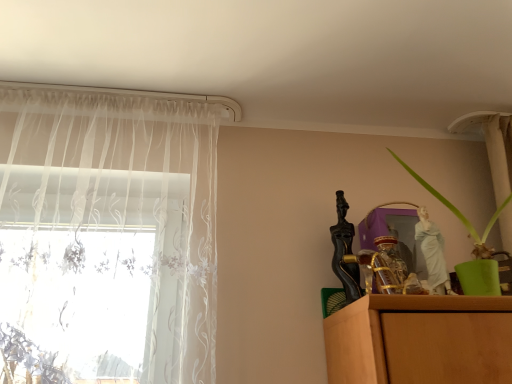
What do you see at coordinates (461, 214) in the screenshot? I see `green matte plant at right` at bounding box center [461, 214].

Where is `green matte plant at right`? green matte plant at right is located at coordinates (461, 214).

Where is `white sheer curtain at left`? The image size is (512, 384). white sheer curtain at left is located at coordinates (106, 239).

The image size is (512, 384). Describe the element at coordinates (106, 239) in the screenshot. I see `white sheer curtain at left` at that location.

Where is `green matte plant at right`? green matte plant at right is located at coordinates (461, 214).

Is green matte plant at right at the right side of white sheer curtain at left?

Correct, you'll find green matte plant at right to the right of white sheer curtain at left.

Which object is more forward, green matte plant at right or white sheer curtain at left?

green matte plant at right is more forward.

Considering the points (490, 250) and (56, 297), which point is behind, point (490, 250) or point (56, 297)?

The point (56, 297) is more distant.

From the image's perspective, between green matte plant at right and white sheer curtain at left, which one is located above?

green matte plant at right appears higher in the image.

From a real-world perspective, is green matte plant at right above or below white sheer curtain at left?

green matte plant at right is below white sheer curtain at left.

Can you confirm if green matte plant at right is thinner than white sheer curtain at left?

In fact, green matte plant at right might be wider than white sheer curtain at left.

Considering the relative sizes of green matte plant at right and white sheer curtain at left in the image provided, is green matte plant at right shorter than white sheer curtain at left?

Yes, green matte plant at right is shorter than white sheer curtain at left.

Is green matte plant at right smaller than white sheer curtain at left?

Yes.

Can white sheer curtain at left be found inside green matte plant at right?

No, white sheer curtain at left is not inside green matte plant at right.

Is there a large distance between green matte plant at right and white sheer curtain at left?

They are positioned close to each other.

Could you tell me if green matte plant at right is turned towards white sheer curtain at left?

No.

How different are the orientations of green matte plant at right and white sheer curtain at left in degrees?

The angular difference between green matte plant at right and white sheer curtain at left is 27.7 degrees.

You are a GUI agent. You are given a task and a screenshot of the screen. Output one action in this format:
    pyautogui.click(x=<x>, y=<y>)
    Task: Click on the plant lying in front of the white sheer curtain at left
    
    Given the screenshot: What is the action you would take?
    pyautogui.click(x=461, y=214)

Consider the image. Considering the relative positions of white sheer curtain at left and green matte plant at right in the image provided, is white sheer curtain at left to the left or to the right of green matte plant at right?

white sheer curtain at left is positioned on green matte plant at right's left side.

In the image, is white sheer curtain at left positioned in front of or behind green matte plant at right?

In the image, white sheer curtain at left appears behind green matte plant at right.

Considering the points (13, 125) and (466, 221), which point is behind, point (13, 125) or point (466, 221)?

The point (466, 221) is more distant.

From the image's perspective, which is below, white sheer curtain at left or green matte plant at right?

white sheer curtain at left is shown below in the image.

From a real-world perspective, which is physically below, white sheer curtain at left or green matte plant at right?

green matte plant at right.

Can you confirm if white sheer curtain at left is thinner than green matte plant at right?

Yes.

Can you confirm if white sheer curtain at left is taller than green matte plant at right?

Correct, white sheer curtain at left is much taller as green matte plant at right.

From the picture: Based on their sizes in the image, would you say white sheer curtain at left is bigger or smaller than green matte plant at right?

In the image, white sheer curtain at left appears to be larger than green matte plant at right.

Is green matte plant at right surrounded by white sheer curtain at left?

No, white sheer curtain at left does not contain green matte plant at right.

Is white sheer curtain at left not near green matte plant at right?

That's not correct — white sheer curtain at left is a little close to green matte plant at right.

Consider the image. Is white sheer curtain at left looking in the opposite direction of green matte plant at right?

No.

In the scene shown: Can you tell me how much white sheer curtain at left and green matte plant at right differ in facing direction?

There is a 27.7-degree angle between the facing directions of white sheer curtain at left and green matte plant at right.

Measure the distance between white sheer curtain at left and green matte plant at right.

A distance of 37.73 inches exists between white sheer curtain at left and green matte plant at right.

You are a GUI agent. You are given a task and a screenshot of the screen. Output one action in this format:
    pyautogui.click(x=<x>, y=<y>)
    Task: Click on the curtain that appears above the green matte plant at right (from a real-world perspective)
    The width and height of the screenshot is (512, 384).
    Given the screenshot: What is the action you would take?
    [x=106, y=239]

You are a GUI agent. You are given a task and a screenshot of the screen. Output one action in this format:
    pyautogui.click(x=<x>, y=<y>)
    Task: Click on the curtain behind the green matte plant at right
    Image resolution: width=512 pixels, height=384 pixels.
    Given the screenshot: What is the action you would take?
    pyautogui.click(x=106, y=239)

Find the location of a particular element. The image size is (512, 384). curtain above the green matte plant at right (from a real-world perspective) is located at coordinates (106, 239).